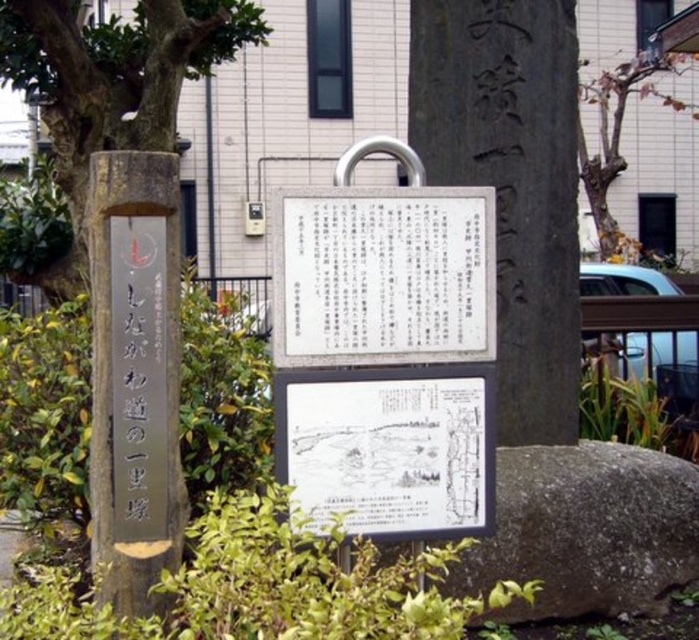
Question: Which object is closer to the camera taking this photo?

Choices:
 (A) brown bark tree at upper right
 (B) black stone tree trunk at center

Answer: (B)

Question: Which object is closer to the camera taking this photo?

Choices:
 (A) white paper at lower center
 (B) brown bark tree at upper right
 (C) white paper sign at center

Answer: (A)

Question: Is the position of black stone tree trunk at center less distant than that of gray stone at lower right?

Choices:
 (A) no
 (B) yes

Answer: (A)

Question: Can you confirm if black stone tree trunk at center is positioned above wooden signpost at left?

Choices:
 (A) yes
 (B) no

Answer: (A)

Question: Can you confirm if wooden signpost at left is positioned to the left of white paper at lower center?

Choices:
 (A) no
 (B) yes

Answer: (B)

Question: Which of the following is the farthest from the observer?

Choices:
 (A) (598, 538)
 (B) (579, 150)
 (C) (298, 502)
 (D) (89, 209)

Answer: (B)